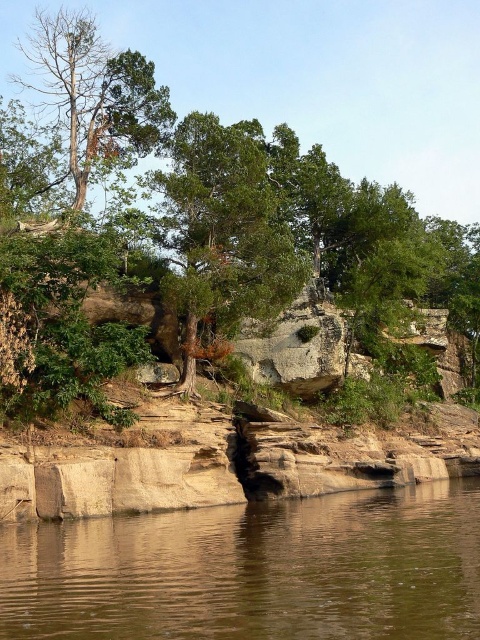
Can you confirm if brown smooth water at lower center is smaller than green leafy tree at center?

Yes.

Is brown smooth water at lower center taller than green leafy tree at center?

Incorrect, brown smooth water at lower center's height is not larger of green leafy tree at center's.

Between point (33, 544) and point (225, 12), which one is positioned behind?

Point (225, 12)

Locate an element on the screen. This screenshot has width=480, height=640. brown smooth water at lower center is located at coordinates (253, 570).

Can you confirm if green matte tree at center is positioned to the left of dead brown tree at upper left?

In fact, green matte tree at center is to the right of dead brown tree at upper left.

Does green matte tree at center appear over dead brown tree at upper left?

Actually, green matte tree at center is below dead brown tree at upper left.

Does point (165, 220) come behind point (136, 74)?

No, (165, 220) is closer to viewer.

You are a GUI agent. You are given a task and a screenshot of the screen. Output one action in this format:
    pyautogui.click(x=<x>, y=<y>)
    Task: Click on the green matte tree at center
    This screenshot has width=480, height=640.
    Given the screenshot: What is the action you would take?
    pyautogui.click(x=223, y=234)

Between green leafy tree at center and green matte tree at center, which one appears on the left side from the viewer's perspective?

green matte tree at center

Is point (448, 84) positioned behind point (232, 140)?

Yes.

Does point (39, 6) lie in front of point (233, 198)?

No, it is behind (233, 198).

Locate an element on the screen. Image resolution: width=480 pixels, height=640 pixels. green leafy tree at center is located at coordinates (312, 76).